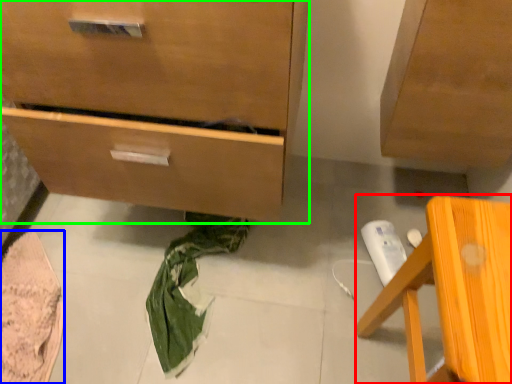
Question: Which object is positioned closest to furniture (highlighted by a red box)? Select from material (highlighted by a blue box) and chest of drawers (highlighted by a green box).

Choices:
 (A) material
 (B) chest of drawers

Answer: (B)